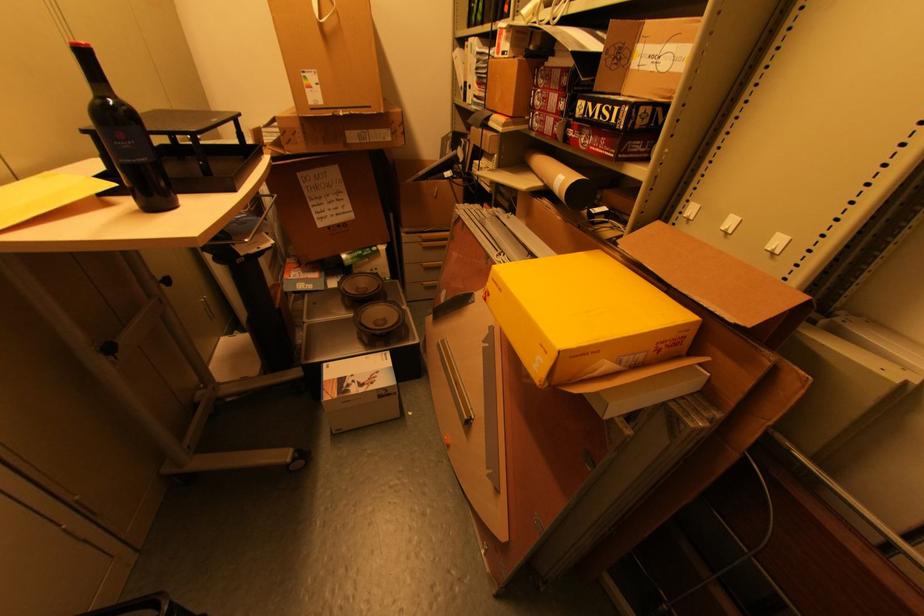
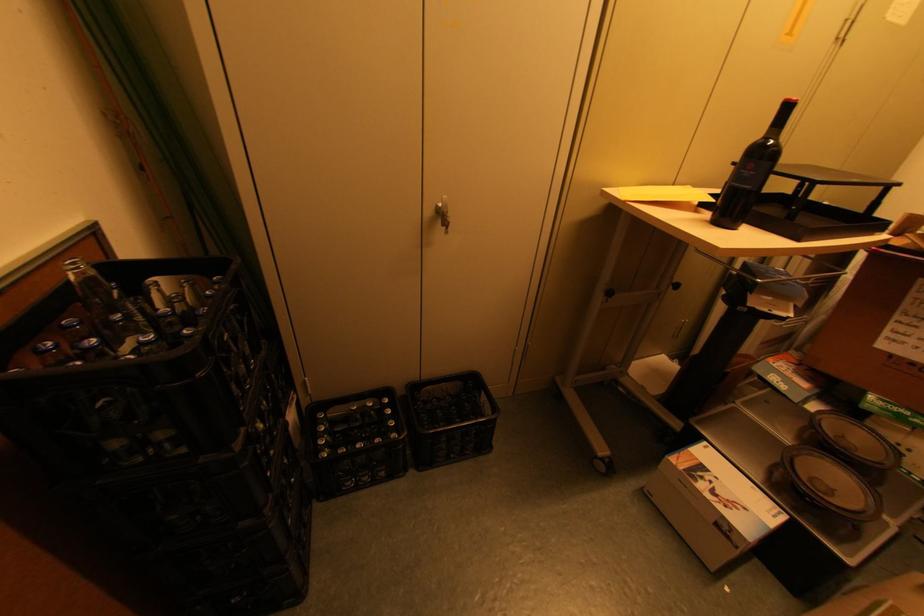
Based on the continuous images, in which direction is the camera rotating?

The rotation direction of the camera is left-down.